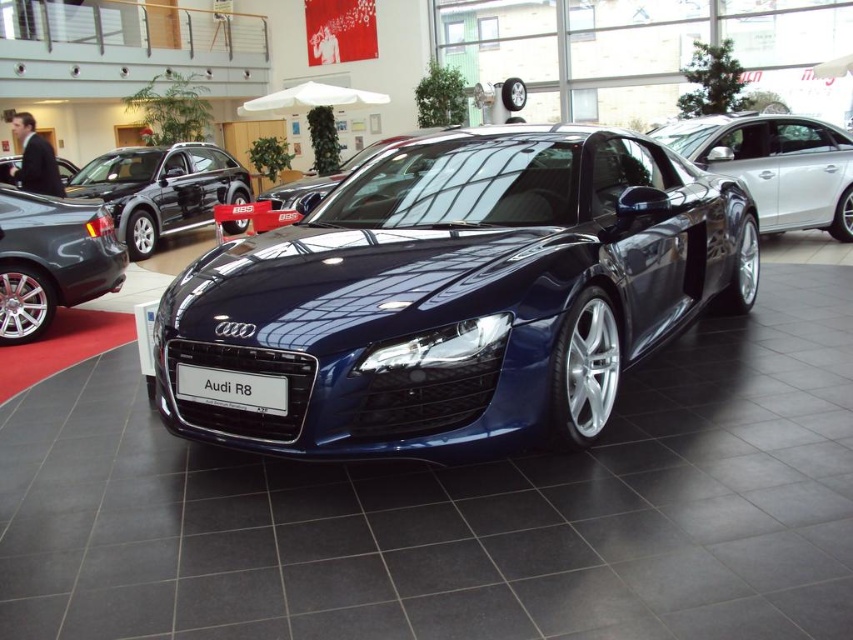
Does glossy black suv at upper left have a smaller size compared to white plastic license plate at center?

Incorrect, glossy black suv at upper left is not smaller in size than white plastic license plate at center.

Between glossy black suv at upper left and white plastic license plate at center, which one appears on the right side from the viewer's perspective?

white plastic license plate at center is more to the right.

The height and width of the screenshot is (640, 853). I want to click on glossy black suv at upper left, so click(x=161, y=189).

Does shiny dark blue audi r8 at center appear on the right side of satin blue car at center?

No, shiny dark blue audi r8 at center is not to the right of satin blue car at center.

This screenshot has width=853, height=640. What are the coordinates of `shiny dark blue audi r8 at center` in the screenshot? It's located at (459, 292).

Is point (621, 248) closer to camera compared to point (805, 147)?

Yes, it is.

You are a GUI agent. You are given a task and a screenshot of the screen. Output one action in this format:
    pyautogui.click(x=<x>, y=<y>)
    Task: Click on the shiny dark blue audi r8 at center
    
    Given the screenshot: What is the action you would take?
    pyautogui.click(x=459, y=292)

Between point (819, 180) and point (79, 301), which one is positioned behind?

Point (819, 180)

Does point (701, 163) come farther from viewer compared to point (4, 236)?

Yes, point (701, 163) is behind point (4, 236).

Which is in front, point (755, 131) or point (54, 232)?

Point (54, 232) is more forward.

In order to click on satin blue car at center in this screenshot , I will do [x=775, y=164].